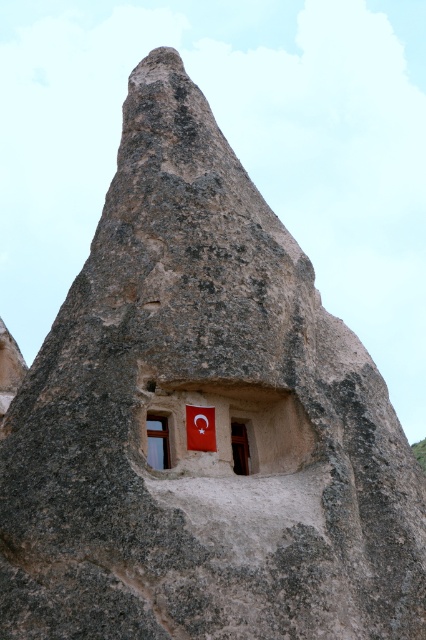
You are a tourist visiting this rock formation and notice two flags at the center. Which flag, the red fabric flag at center or the matte red flag at center, is shorter in height?

The red fabric flag at center has a lesser height compared to the matte red flag at center, so the red fabric flag at center is shorter.

From the picture: You are an architect analyzing the dimensions of the structures on the rock formation. Given that the matte wood window at center is 1.5 meters tall, can you determine if the red fabric flag at center would fit vertically inside the window frame without folding?

The red fabric flag at center is shorter than the matte wood window at center. Since the window is 1.5 meters tall, the flag would fit vertically inside the window frame without folding.

You are a tourist standing in front of the rock formation and want to take a photo of the matte wood window at center and the red fabric flag at center. Based on their positions, which object should you focus on first if you want to capture both in a single frame without moving the camera?

The red fabric flag at center is to the right of the matte wood window at center, so you should focus on the matte wood window at center first to ensure both objects are within the camera frame.